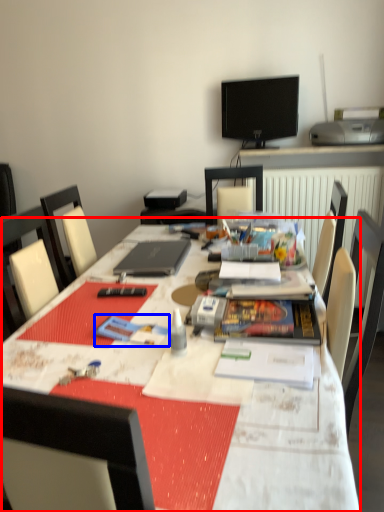
Question: Among these objects, which one is farthest to the camera, table (highlighted by a red box) or paperback book (highlighted by a blue box)?

Choices:
 (A) table
 (B) paperback book

Answer: (B)